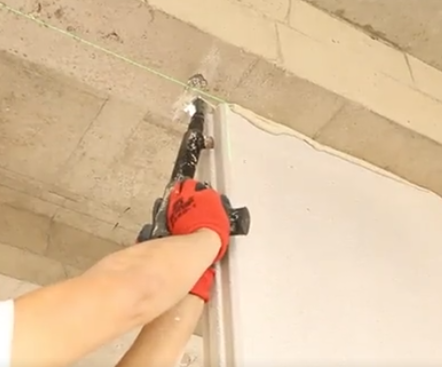
Locate an element on the screen. beige wall is located at coordinates (285, 231).